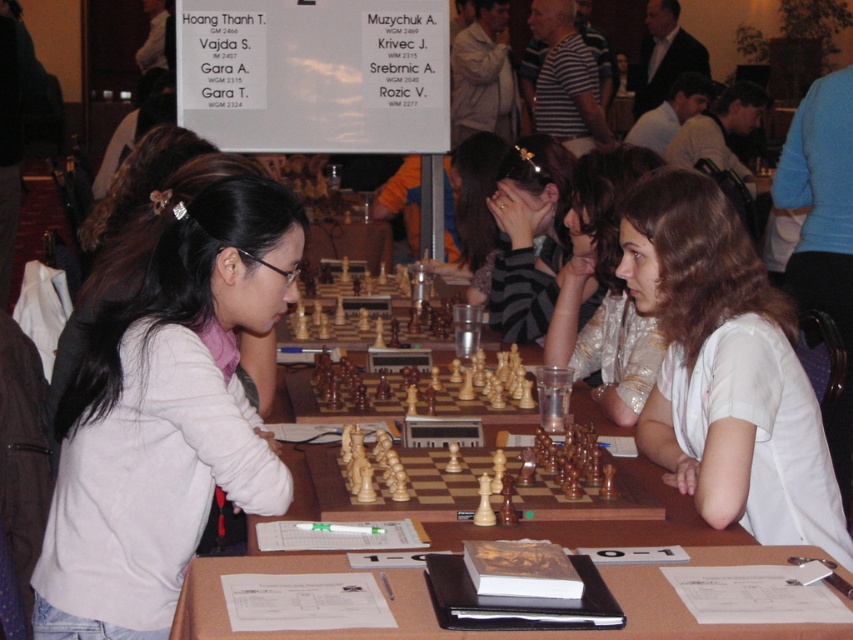
Based on the photo, measure the distance between point (x=55, y=554) and camera.

Point (x=55, y=554) and camera are 5.16 feet apart.

Is white matte shirt at left to the right of shiny silver blouse at center from the viewer's perspective?

No, white matte shirt at left is not to the right of shiny silver blouse at center.

Find the location of a particular element. white matte shirt at left is located at coordinates (166, 416).

Does wooden chess set at center appear on the left side of light brown wood chess set at center?

Indeed, wooden chess set at center is positioned on the left side of light brown wood chess set at center.

Who is more forward, (312, 381) or (514, 492)?

Positioned in front is point (514, 492).

At what (x,y) coordinates should I click in order to perform the action: click on wooden chess set at center. Please return your answer as a coordinate pair (x, y). The height and width of the screenshot is (640, 853). Looking at the image, I should click on (428, 388).

This screenshot has width=853, height=640. Identify the location of wooden chess set at center. pyautogui.click(x=428, y=388).

Does wooden table at center have a smaller size compared to shiny silver blouse at center?

Indeed, wooden table at center has a smaller size compared to shiny silver blouse at center.

Does wooden table at center appear on the right side of shiny silver blouse at center?

In fact, wooden table at center is to the left of shiny silver blouse at center.

Which is behind, point (260, 563) or point (614, 400)?

Point (614, 400)

Where is `wooden table at center`? The height and width of the screenshot is (640, 853). wooden table at center is located at coordinates (459, 632).